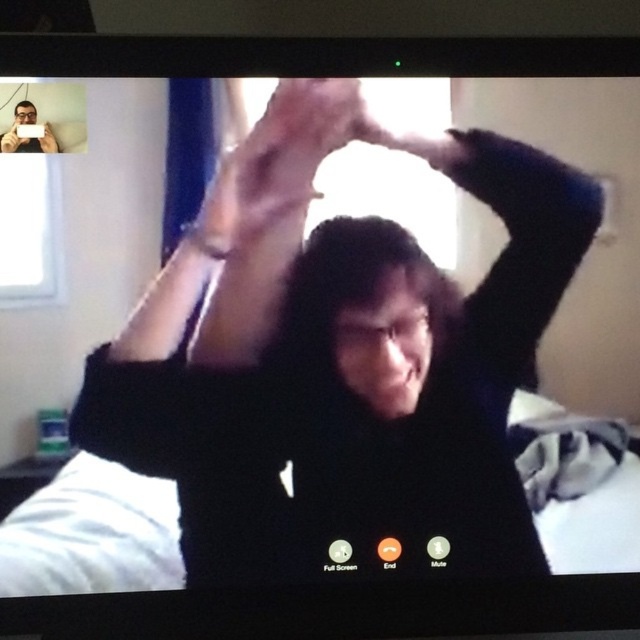
Can you confirm if black matte shirt at center is shorter than matte black hair at center?

In fact, black matte shirt at center may be taller than matte black hair at center.

Consider the image. Which of these two, black matte shirt at center or matte black hair at center, stands taller?

Standing taller between the two is black matte shirt at center.

Between point (545, 253) and point (397, 372), which one is positioned behind?

Positioned behind is point (397, 372).

You are a GUI agent. You are given a task and a screenshot of the screen. Output one action in this format:
    pyautogui.click(x=<x>, y=<y>)
    Task: Click on the black matte shirt at center
    
    Given the screenshot: What is the action you would take?
    pyautogui.click(x=342, y=364)

Is smooth skin hand at center thinner than matte black phone at upper left?

In fact, smooth skin hand at center might be wider than matte black phone at upper left.

Is smooth skin hand at center in front of matte black phone at upper left?

That is False.

Does point (259, 106) come farther from viewer compared to point (12, 150)?

Yes, point (259, 106) is farther from viewer.

Image resolution: width=640 pixels, height=640 pixels. Find the location of `smooth skin hand at center`. smooth skin hand at center is located at coordinates (248, 100).

The height and width of the screenshot is (640, 640). I want to click on matte black hair at center, so click(x=365, y=316).

Can you confirm if matte black hair at center is bigger than matte black hair at upper center?

Yes, matte black hair at center is bigger than matte black hair at upper center.

Which is in front, point (448, 355) or point (24, 108)?

Point (24, 108)

This screenshot has width=640, height=640. What are the coordinates of `matte black hair at center` in the screenshot? It's located at (365, 316).